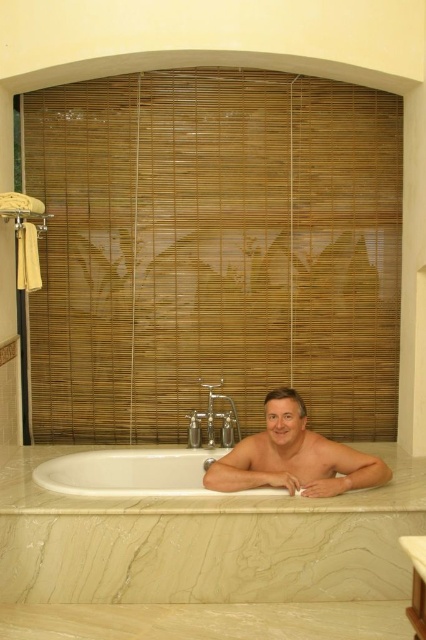
Question: Can you confirm if white marble bathtub at center is positioned above smooth skin man at center?

Choices:
 (A) no
 (B) yes

Answer: (A)

Question: Estimate the real-world distances between objects in this image. Which object is closer to the white marble bathtub at center?

Choices:
 (A) white glossy bathtub at lower left
 (B) smooth skin man at center

Answer: (B)

Question: Which of the following is the farthest from the observer?

Choices:
 (A) white marble bathtub at center
 (B) white glossy bathtub at lower left
 (C) smooth skin man at center

Answer: (B)

Question: Is white marble bathtub at center to the left of white glossy bathtub at lower left from the viewer's perspective?

Choices:
 (A) no
 (B) yes

Answer: (A)

Question: Does smooth skin man at center appear on the right side of white glossy bathtub at lower left?

Choices:
 (A) yes
 (B) no

Answer: (A)

Question: Which point is farther to the camera?

Choices:
 (A) (316, 493)
 (B) (143, 490)
 (C) (227, 545)

Answer: (B)